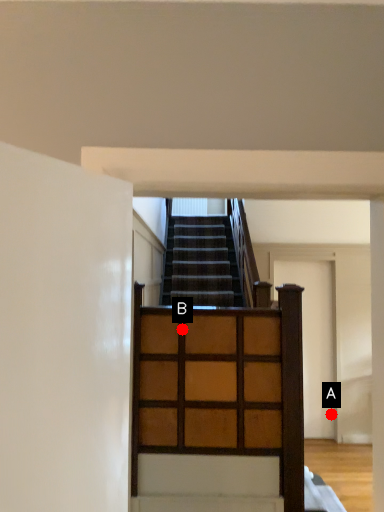
Question: Two points are circled on the image, labeled by A and B beside each circle. Which of the following is the farthest from the observer?

Choices:
 (A) A is further
 (B) B is further

Answer: (A)